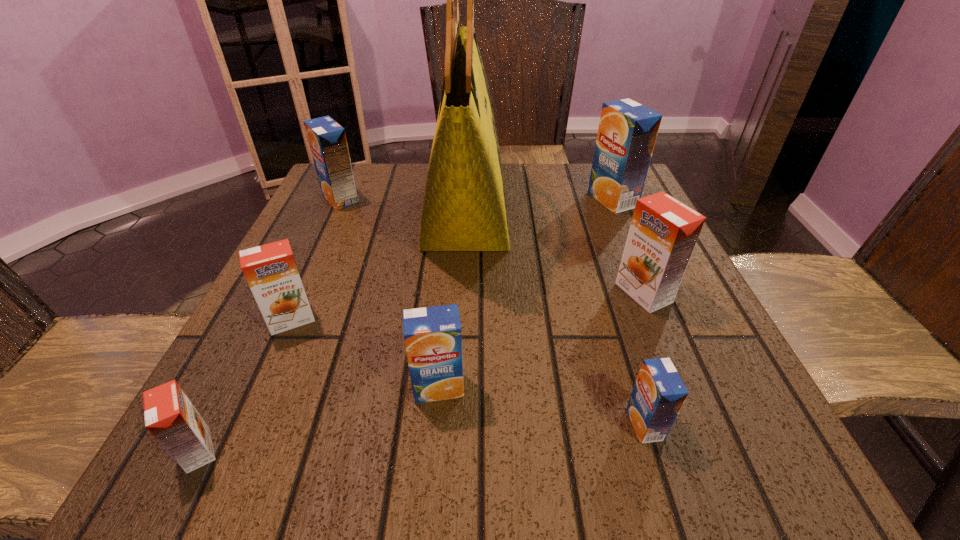
I want to click on the third blue orange_juice from left to right, so click(x=659, y=393).

The image size is (960, 540). What are the coordinates of `the nearest orange orange juice` in the screenshot? It's located at (170, 417).

The width and height of the screenshot is (960, 540). In order to click on free spot located on the front-facing side of the yellow tote bag in this screenshot , I will do `click(618, 215)`.

Find the location of a particular element. vacant region located 0.110m on the front of the biggest blue orange_juice is located at coordinates [631, 243].

At what (x,y) coordinates should I click in order to perform the action: click on blank space located 0.170m on the right of the third smallest blue orange_juice. Please return your answer as a coordinate pair (x, y). The width and height of the screenshot is (960, 540). Looking at the image, I should click on (433, 199).

At what (x,y) coordinates should I click in order to perform the action: click on vacant area situated on the back of the biggest orange orange juice. Please return your answer as a coordinate pair (x, y). The image size is (960, 540). Looking at the image, I should click on (595, 173).

You are a GUI agent. You are given a task and a screenshot of the screen. Output one action in this format:
    pyautogui.click(x=<x>, y=<y>)
    Task: Click on the free point located 0.200m on the front of the second biggest orange orange juice
    The width and height of the screenshot is (960, 540).
    Given the screenshot: What is the action you would take?
    pyautogui.click(x=233, y=452)

Identify the location of blank space located 0.130m on the left of the third biggest blue orange_juice. The width and height of the screenshot is (960, 540). (324, 387).

Locate an element on the screen. free region located 0.140m on the right of the smallest blue orange_juice is located at coordinates (761, 424).

I want to click on vacant space situated 0.090m on the back of the smallest orange orange juice, so click(x=237, y=374).